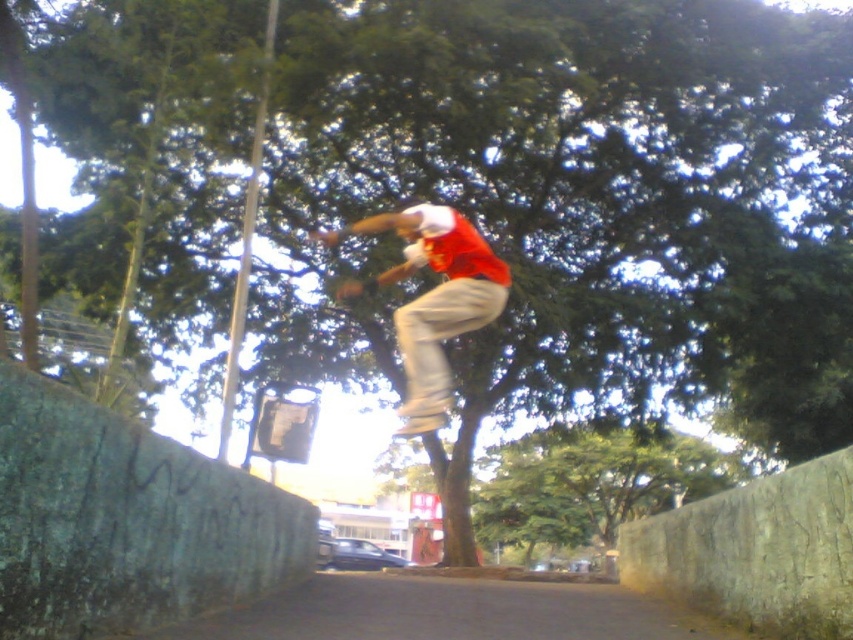
Between matte red shirt at center and wooden skateboard at center, which one has less height?

With less height is wooden skateboard at center.

Who is taller, matte red shirt at center or wooden skateboard at center?

matte red shirt at center is taller.

Who is more forward, (437, 401) or (412, 428)?

Point (412, 428) is more forward.

This screenshot has height=640, width=853. I want to click on matte red shirt at center, so pos(434,300).